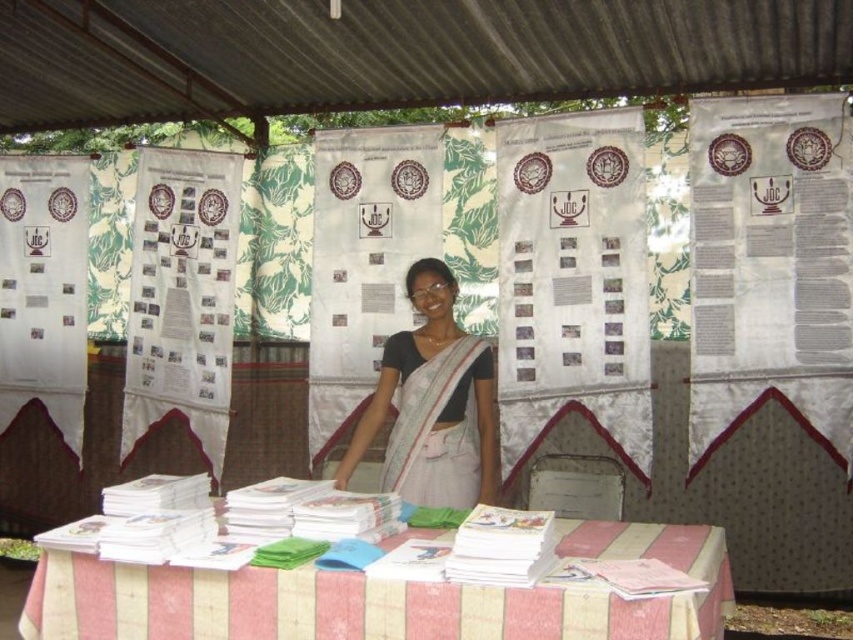
Is white striped fabric at lower center positioned at the back of white silk saree at center?

No, it is in front of white silk saree at center.

Does white striped fabric at lower center have a smaller size compared to white silk saree at center?

No.

Is point (293, 589) farther from viewer compared to point (434, 353)?

No, (293, 589) is in front of (434, 353).

You are a GUI agent. You are given a task and a screenshot of the screen. Output one action in this format:
    pyautogui.click(x=<x>, y=<y>)
    Task: Click on the white striped fabric at lower center
    This screenshot has width=853, height=640.
    Given the screenshot: What is the action you would take?
    pyautogui.click(x=380, y=596)

This screenshot has height=640, width=853. Describe the element at coordinates (436, 396) in the screenshot. I see `white silk saree at center` at that location.

Who is more forward, (384, 387) or (402, 426)?

Point (402, 426) is in front.

Measure the distance between point (436, 316) and camera.

Point (436, 316) is 3.23 meters from camera.

The image size is (853, 640). I want to click on white silk saree at center, so click(x=436, y=396).

Who is positioned more to the right, white striped fabric at lower center or white cotton sari at center?

white cotton sari at center is more to the right.

Who is more forward, (323,604) or (410,481)?

Point (323,604)

Where is `white striped fabric at lower center`? The image size is (853, 640). white striped fabric at lower center is located at coordinates (380, 596).